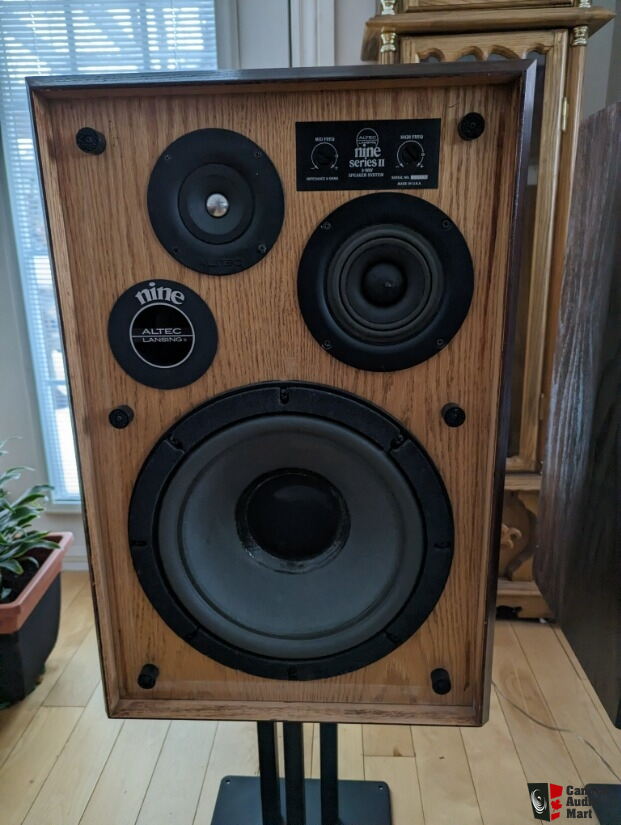
This screenshot has width=621, height=825. What are the coordinates of `window with blinds open letting in light` in the screenshot? It's located at (5, 101), (53, 483), (199, 8), (14, 12), (197, 59).